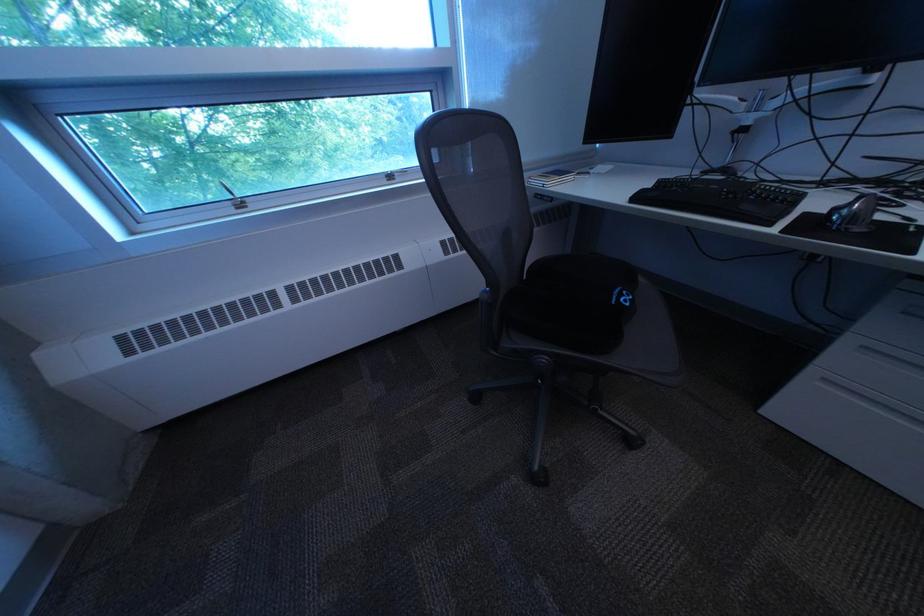
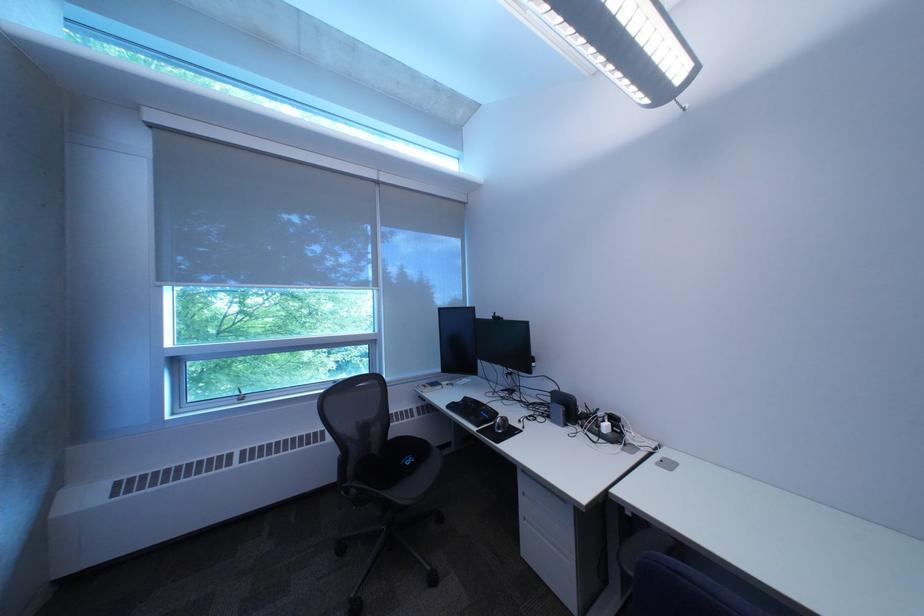
In the second image, find the point that corresponds to pixel 637 296 in the first image.

(423, 461)